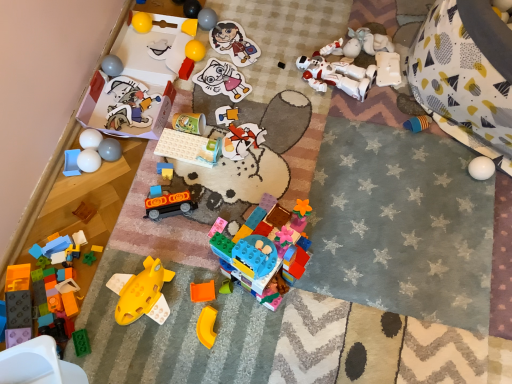
At what (x,y) coordinates should I click in order to perform the action: click on vacant area that lies between matte plastic blocks at center, which appears as the fifteenth toy when viewed from the right, and translucent orange plastic at center, arranged as the nineteenth toy when viewed from the left. Please return your answer as a coordinate pair (x, y). Image resolution: width=512 pixels, height=384 pixels. Looking at the image, I should click on (193, 231).